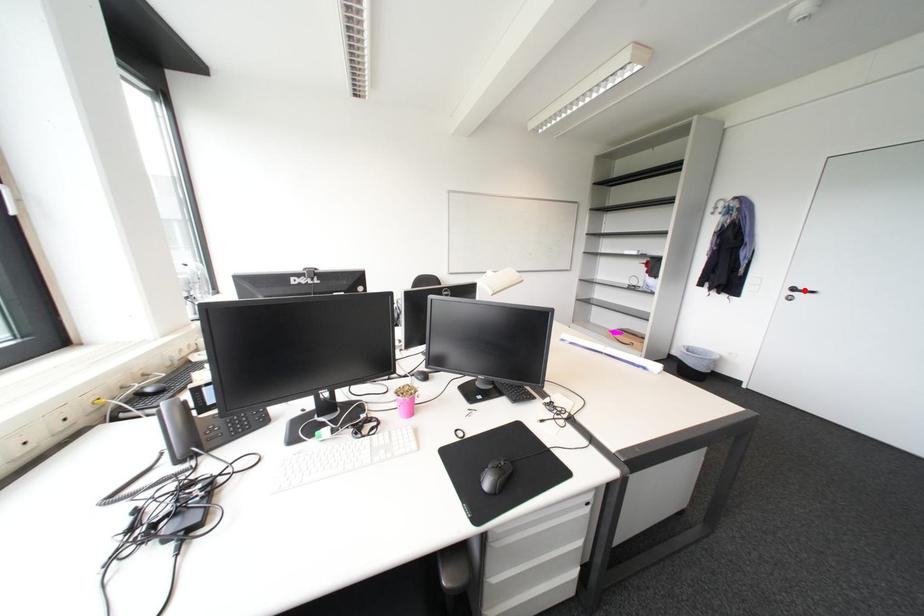
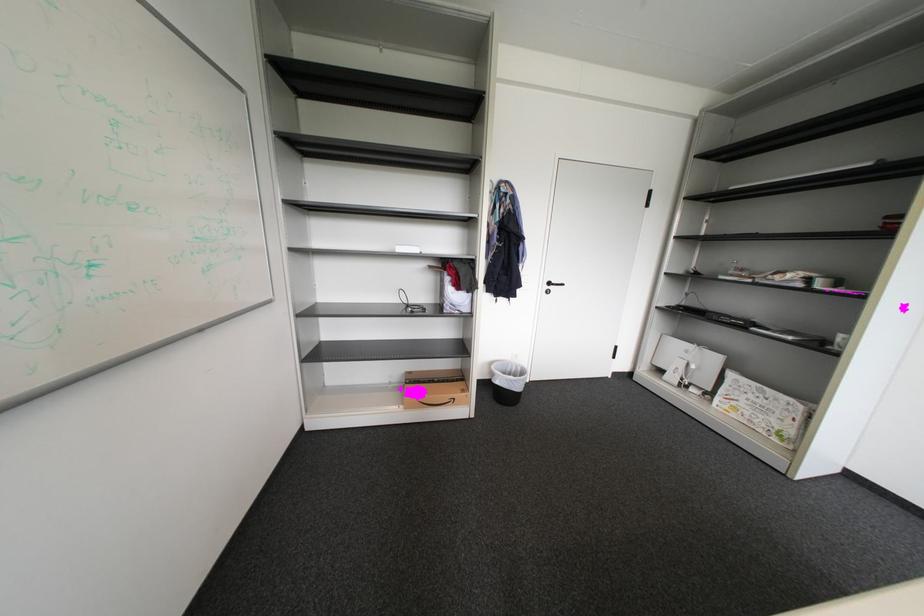
In the second image, find the point that corresponds to the highlighted location in the first image.

(560, 285)